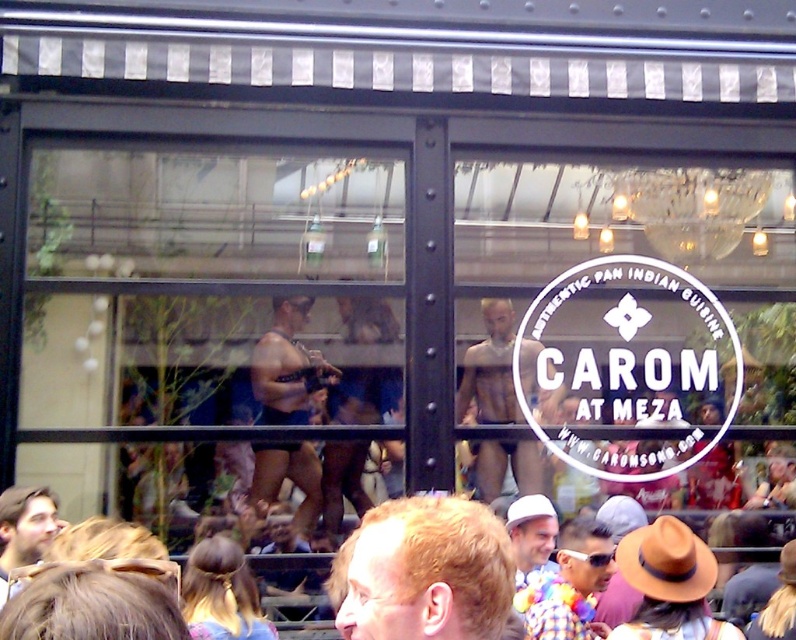
Describe the element at coordinates (287, 365) in the screenshot. This screenshot has height=640, width=796. I see `smooth black shorts at center` at that location.

Between point (295, 468) and point (272, 566), which one is positioned in front?

Point (272, 566) is in front.

Between point (263, 397) and point (747, 544), which one is positioned behind?

Point (747, 544)

The width and height of the screenshot is (796, 640). I want to click on smooth black shorts at center, so click(x=287, y=365).

Consider the image. Can you confirm if transparent glass door at upper left is wider than smooth black shorts at center?

Indeed, transparent glass door at upper left has a greater width compared to smooth black shorts at center.

Between point (170, 481) and point (303, 305), which one is positioned in front?

Point (170, 481) is in front.

Locate an element on the screen. The image size is (796, 640). transparent glass door at upper left is located at coordinates (209, 321).

Consider the image. Is brown felt cowboy hat at lower right wider than brown felt hat at lower right?

Yes, brown felt cowboy hat at lower right is wider than brown felt hat at lower right.

Does brown felt cowboy hat at lower right appear on the left side of brown felt hat at lower right?

No, brown felt cowboy hat at lower right is not to the left of brown felt hat at lower right.

Locate an element on the screen. brown felt cowboy hat at lower right is located at coordinates (666, 561).